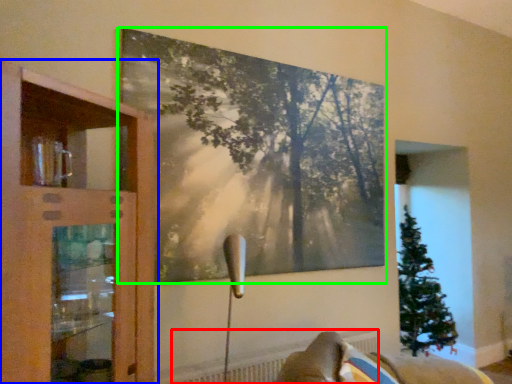
Question: Estimate the real-world distances between objects in this image. Which object is closer to radiator (highlighted by a red box), cupboard (highlighted by a blue box) or picture frame (highlighted by a green box)?

Choices:
 (A) cupboard
 (B) picture frame

Answer: (A)